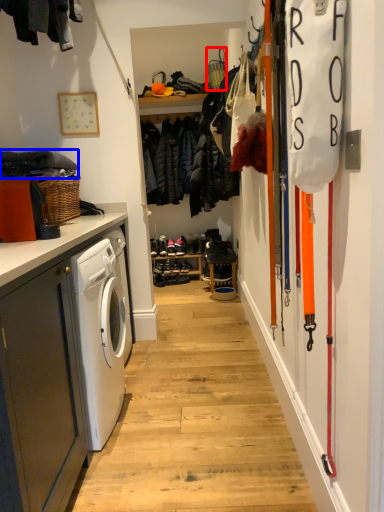
Question: Among these objects, which one is farthest to the camera, basket (highlighted by a red box) or clothing (highlighted by a blue box)?

Choices:
 (A) basket
 (B) clothing

Answer: (A)